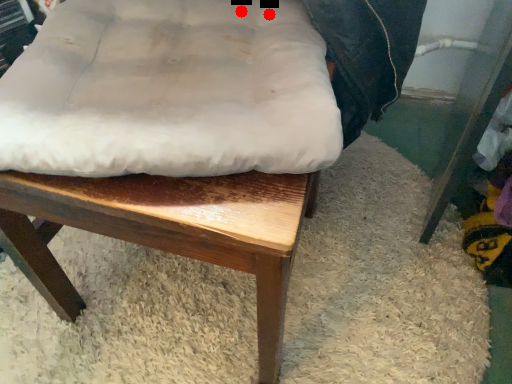
Question: Two points are circled on the image, labeled by A and B beside each circle. Which point is closer to the camera taking this photo?

Choices:
 (A) A is closer
 (B) B is closer

Answer: (A)